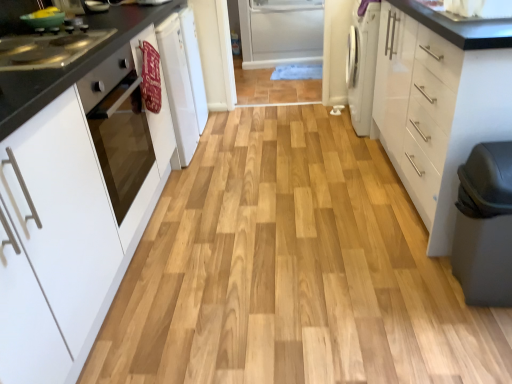
The image size is (512, 384). What are the coordinates of `matte gray step stool at lower right` in the screenshot? It's located at (485, 226).

At what (x,y) coordinates should I click in order to perform the action: click on black glossy countertop at left. Please return your answer as a coordinate pair (x, y). This screenshot has width=512, height=384. Looking at the image, I should click on (71, 65).

Identify the location of stainless steel stove at left. This screenshot has width=512, height=384. (48, 49).

Considering the positions of points (452, 120) and (469, 232), is point (452, 120) closer to camera compared to point (469, 232)?

No, it is not.

From a real-world perspective, is white glossy cabinet at right, positioned as the second cabinetry in left-to-right order, on top of matte gray step stool at lower right?

Yes, from a real-world perspective, white glossy cabinet at right, positioned as the second cabinetry in left-to-right order, is over matte gray step stool at lower right

From the image's perspective, relative to matte gray step stool at lower right, is white glossy cabinet at right, positioned as the 1th cabinetry in right-to-left order, above or below?

From the image's perspective, white glossy cabinet at right, positioned as the 1th cabinetry in right-to-left order, appears above matte gray step stool at lower right.

Which object is positioned more to the right, white glossy cabinet at right, positioned as the second cabinetry in left-to-right order, or matte gray step stool at lower right?

From the viewer's perspective, white glossy cabinet at right, positioned as the second cabinetry in left-to-right order, appears more on the right side.

Considering the positions of objects white matte cabinet at left, which appears as the second cabinetry when viewed from the right, and white glossy sink at upper right in the image provided, who is in front, white matte cabinet at left, which appears as the second cabinetry when viewed from the right, or white glossy sink at upper right?

white matte cabinet at left, which appears as the second cabinetry when viewed from the right.

I want to click on sink above the white matte cabinet at left, which appears as the second cabinetry when viewed from the right (from a real-world perspective), so click(471, 9).

Looking at this image, is white matte cabinet at left, which is counted as the 1th cabinetry, starting from the left, facing away from white glossy sink at upper right?

white matte cabinet at left, which is counted as the 1th cabinetry, starting from the left, is not turned away from white glossy sink at upper right.

From the image's perspective, is white glossy sink at upper right located above or below black glossy countertop at left?

From the image's perspective, white glossy sink at upper right appears above black glossy countertop at left.

Considering the sizes of objects white glossy sink at upper right and black glossy countertop at left in the image provided, who is smaller, white glossy sink at upper right or black glossy countertop at left?

With smaller size is white glossy sink at upper right.

Are white glossy sink at upper right and black glossy countertop at left making contact?

No, white glossy sink at upper right is not making contact with black glossy countertop at left.

Looking at this image, considering the sizes of objects white glossy sink at upper right and black glossy countertop at left in the image provided, who is thinner, white glossy sink at upper right or black glossy countertop at left?

A: white glossy sink at upper right is thinner.

Considering the relative sizes of white glossy cabinet at right, positioned as the second cabinetry in left-to-right order, and white glossy sink at upper right in the image provided, is white glossy cabinet at right, positioned as the second cabinetry in left-to-right order, thinner than white glossy sink at upper right?

Incorrect, the width of white glossy cabinet at right, positioned as the second cabinetry in left-to-right order, is not less than that of white glossy sink at upper right.

Looking at this image, from the image's perspective, is white glossy cabinet at right, positioned as the second cabinetry in left-to-right order, on white glossy sink at upper right?

No, from the image's perspective, white glossy cabinet at right, positioned as the second cabinetry in left-to-right order, is not above white glossy sink at upper right.

Based on the photo, in terms of size, does white glossy cabinet at right, positioned as the second cabinetry in left-to-right order, appear bigger or smaller than white glossy sink at upper right?

white glossy cabinet at right, positioned as the second cabinetry in left-to-right order, is bigger than white glossy sink at upper right.

Is white glossy cabinet at right, positioned as the second cabinetry in left-to-right order, oriented away from white glossy sink at upper right?

white glossy cabinet at right, positioned as the second cabinetry in left-to-right order, is not turned away from white glossy sink at upper right.

Can you confirm if black glossy countertop at left is shorter than white glossy sink at upper right?

Incorrect, the height of black glossy countertop at left does not fall short of that of white glossy sink at upper right.

Measure the distance from black glossy countertop at left to white glossy sink at upper right.

black glossy countertop at left and white glossy sink at upper right are 1.37 meters apart from each other.

Which object is thinner, black glossy countertop at left or white glossy sink at upper right?

white glossy sink at upper right is thinner.

From a real-world perspective, is black glossy countertop at left above or below white glossy sink at upper right?

black glossy countertop at left is situated lower than white glossy sink at upper right in the real world.

From the image's perspective, which is below, matte gray step stool at lower right or white glossy sink at upper right?

matte gray step stool at lower right appears lower in the image.

Would you say matte gray step stool at lower right is to the left or to the right of white glossy sink at upper right in the picture?

matte gray step stool at lower right is positioned on white glossy sink at upper right's left side.

This screenshot has height=384, width=512. Find the location of `step stool that is on the left side of white glossy sink at upper right`. step stool that is on the left side of white glossy sink at upper right is located at coordinates (485, 226).

From the picture: Would you say matte gray step stool at lower right is outside white glossy sink at upper right?

matte gray step stool at lower right is positioned outside white glossy sink at upper right.

Could you tell me if white matte cabinet at left, which appears as the second cabinetry when viewed from the right, is facing white glossy oven at left?

Yes, white matte cabinet at left, which appears as the second cabinetry when viewed from the right, is facing white glossy oven at left.

From a real-world perspective, does white matte cabinet at left, which appears as the second cabinetry when viewed from the right, sit lower than white glossy oven at left?

Indeed, from a real-world perspective, white matte cabinet at left, which appears as the second cabinetry when viewed from the right, is positioned beneath white glossy oven at left.

From the image's perspective, is white matte cabinet at left, which appears as the second cabinetry when viewed from the right, under white glossy oven at left?

Indeed, from the image's perspective, white matte cabinet at left, which appears as the second cabinetry when viewed from the right, is shown beneath white glossy oven at left.

Considering the sizes of white matte cabinet at left, which is counted as the 1th cabinetry, starting from the left, and white glossy oven at left in the image, is white matte cabinet at left, which is counted as the 1th cabinetry, starting from the left, wider or thinner than white glossy oven at left?

Clearly, white matte cabinet at left, which is counted as the 1th cabinetry, starting from the left, has more width compared to white glossy oven at left.

From a real-world perspective, which cabinetry is the 1st one above the matte gray step stool at lower right? Please provide its 2D coordinates.

[(439, 102)]

At what (x,y) coordinates should I click in order to perform the action: click on sink behind the white matte cabinet at left, which appears as the second cabinetry when viewed from the right. Please return your answer as a coordinate pair (x, y). Looking at the image, I should click on (471, 9).

Based on their spatial positions, is white matte cabinet at left, which is counted as the 1th cabinetry, starting from the left, or white glossy sink at upper right closer to white glossy cabinet at right, positioned as the second cabinetry in left-to-right order?

white glossy sink at upper right is closer to white glossy cabinet at right, positioned as the second cabinetry in left-to-right order.

Looking at the image, which one is located closer to stainless steel stove at left, matte gray step stool at lower right or black glossy countertop at left?

black glossy countertop at left.

Estimate the real-world distances between objects in this image. Which object is further from white matte cabinet at left, which appears as the second cabinetry when viewed from the right, white glossy oven at left or black glossy countertop at left?

Among the two, black glossy countertop at left is located further to white matte cabinet at left, which appears as the second cabinetry when viewed from the right.

Which object lies nearer to the anchor point white matte cabinet at left, which appears as the second cabinetry when viewed from the right, white glossy oven at left or stainless steel stove at left?

white glossy oven at left is positioned closer to the anchor white matte cabinet at left, which appears as the second cabinetry when viewed from the right.

Looking at the image, which one is located closer to white matte cabinet at left, which appears as the second cabinetry when viewed from the right, white glossy sink at upper right or stainless steel stove at left?

stainless steel stove at left lies closer to white matte cabinet at left, which appears as the second cabinetry when viewed from the right, than the other object.

Considering their positions, is white glossy sink at upper right positioned further to matte gray step stool at lower right than white glossy oven at left?

Based on the image, white glossy oven at left appears to be further to matte gray step stool at lower right.

Considering their positions, is black glossy countertop at left positioned further to matte gray step stool at lower right than stainless steel stove at left?

stainless steel stove at left is further to matte gray step stool at lower right.

From the image, which object appears to be farther from white matte cabinet at left, which appears as the second cabinetry when viewed from the right, stainless steel stove at left or white glossy cabinet at right, positioned as the second cabinetry in left-to-right order?

white glossy cabinet at right, positioned as the second cabinetry in left-to-right order, is further to white matte cabinet at left, which appears as the second cabinetry when viewed from the right.

At what (x,y) coordinates should I click in order to perform the action: click on countertop between white matte cabinet at left, which appears as the second cabinetry when viewed from the right, and white glossy sink at upper right, in the horizontal direction. Please return your answer as a coordinate pair (x, y). This screenshot has width=512, height=384. Looking at the image, I should click on (71, 65).

I want to click on home appliance between black glossy countertop at left and white glossy sink at upper right from left to right, so click(118, 127).

Locate an element on the screen. home appliance situated between white matte cabinet at left, which is counted as the 1th cabinetry, starting from the left, and white glossy sink at upper right from left to right is located at coordinates (118, 127).

Image resolution: width=512 pixels, height=384 pixels. In order to click on home appliance between stainless steel stove at left and white glossy cabinet at right, positioned as the 1th cabinetry in right-to-left order, from left to right in this screenshot , I will do `click(118, 127)`.